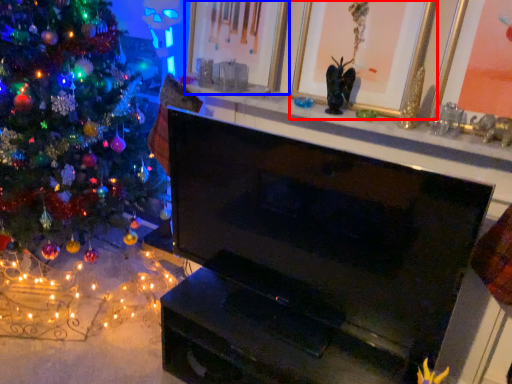
Question: Which of the following is the farthest to the observer, picture frame (highlighted by a red box) or picture frame (highlighted by a blue box)?

Choices:
 (A) picture frame
 (B) picture frame

Answer: (B)